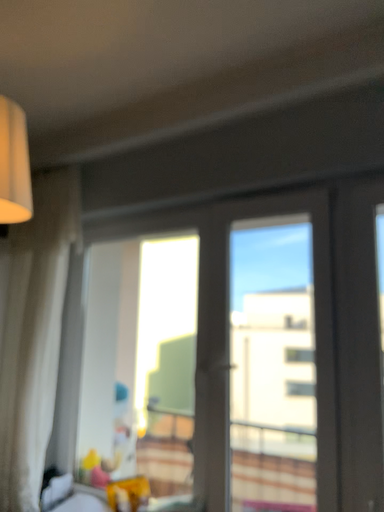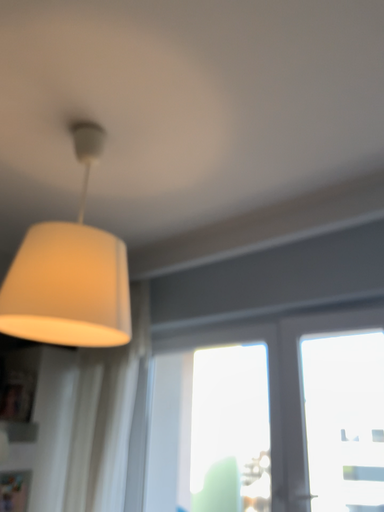
Question: Which way did the camera rotate in the video?

Choices:
 (A) rotated downward
 (B) rotated upward

Answer: (B)